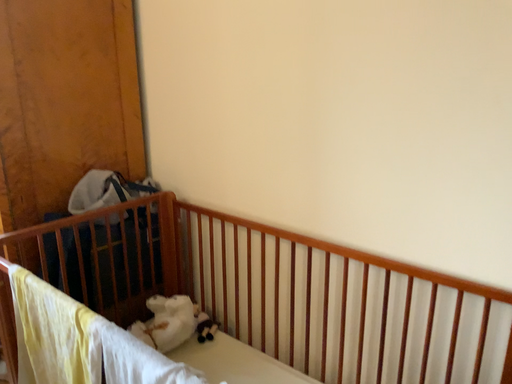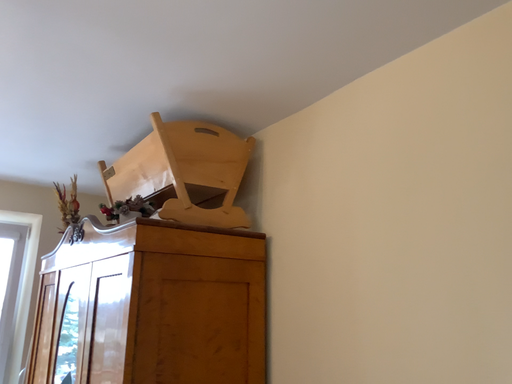
Question: How did the camera likely rotate when shooting the video?

Choices:
 (A) rotated right
 (B) rotated left

Answer: (B)